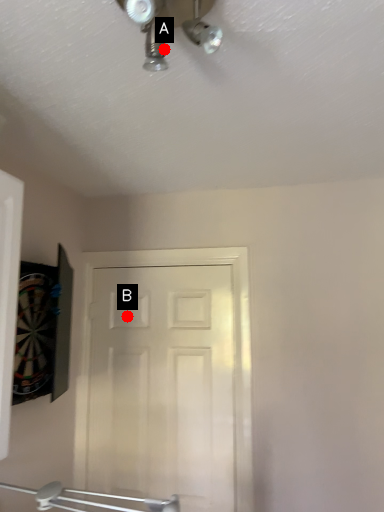
Question: Two points are circled on the image, labeled by A and B beside each circle. Which point is farther to the camera?

Choices:
 (A) A is further
 (B) B is further

Answer: (B)